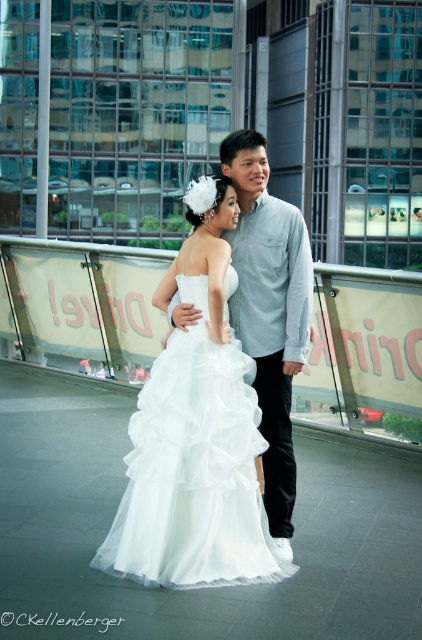
Can you confirm if white tulle dress at center is smaller than light blue shirt at center?

No.

Which of these two, white tulle dress at center or light blue shirt at center, stands shorter?

With less height is white tulle dress at center.

Identify the location of white tulle dress at center. Image resolution: width=422 pixels, height=640 pixels. (194, 468).